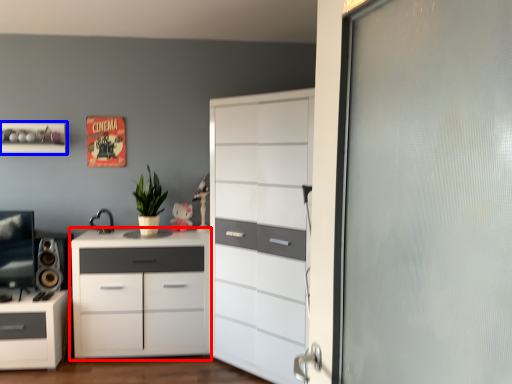
Question: Among these objects, which one is farthest to the camera, chest of drawers (highlighted by a red box) or shelf (highlighted by a blue box)?

Choices:
 (A) chest of drawers
 (B) shelf

Answer: (B)